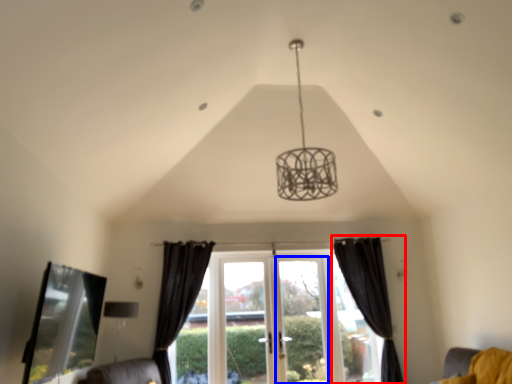
Question: Which object appears farthest to the camera in this image, curtain (highlighted by a red box) or screen door (highlighted by a blue box)?

Choices:
 (A) curtain
 (B) screen door

Answer: (B)